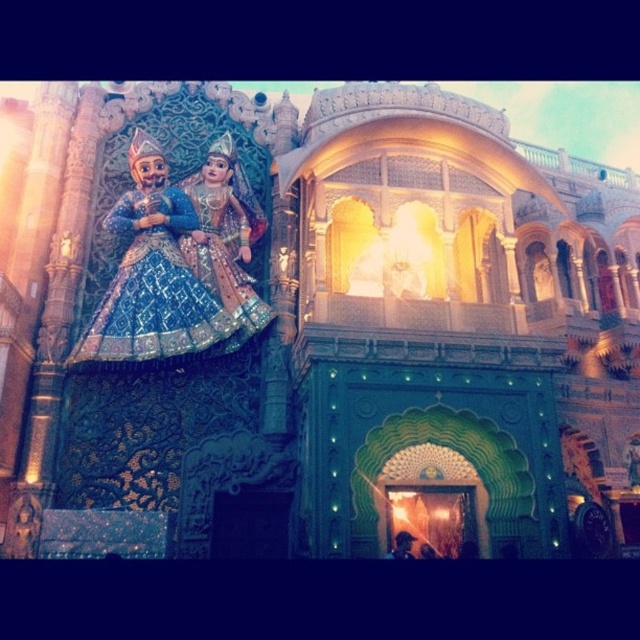
Which is behind, point (400, 148) or point (90, 326)?

The point (400, 148) is more distant.

Locate an element on the screen. The height and width of the screenshot is (640, 640). green carved wood palace at upper center is located at coordinates (317, 323).

This screenshot has width=640, height=640. I want to click on green carved wood palace at upper center, so click(x=317, y=323).